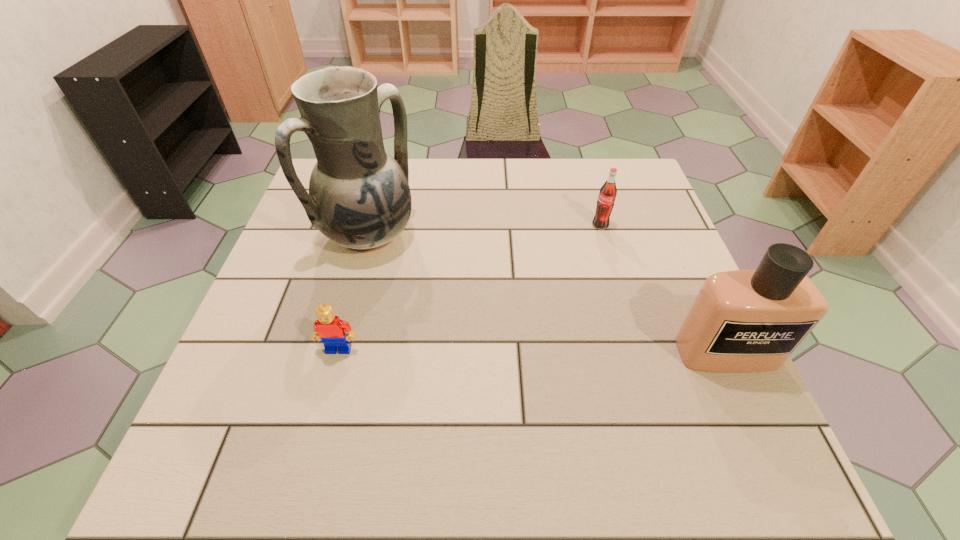
The width and height of the screenshot is (960, 540). In order to click on free space on the desktop that is between the shortest object and the rightmost object and is positioned on the label of the soda bottle in this screenshot , I will do `click(563, 351)`.

Image resolution: width=960 pixels, height=540 pixels. Identify the location of free space on the desktop that is between the shortest object and the second tallest object and is positioned on the front-facing side of the tallest object. (515, 351).